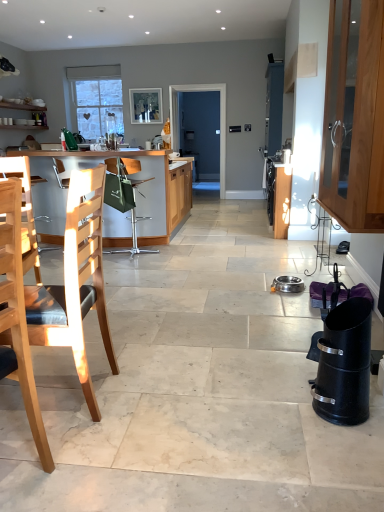
You are a GUI agent. You are given a task and a screenshot of the screen. Output one action in this format:
    pyautogui.click(x=<x>, y=<y>)
    Task: Click on the vacant region to the right of black matte trash can at lower right, the second appliance from the back
    Image resolution: width=384 pixels, height=512 pixels.
    Given the screenshot: What is the action you would take?
    pyautogui.click(x=374, y=410)